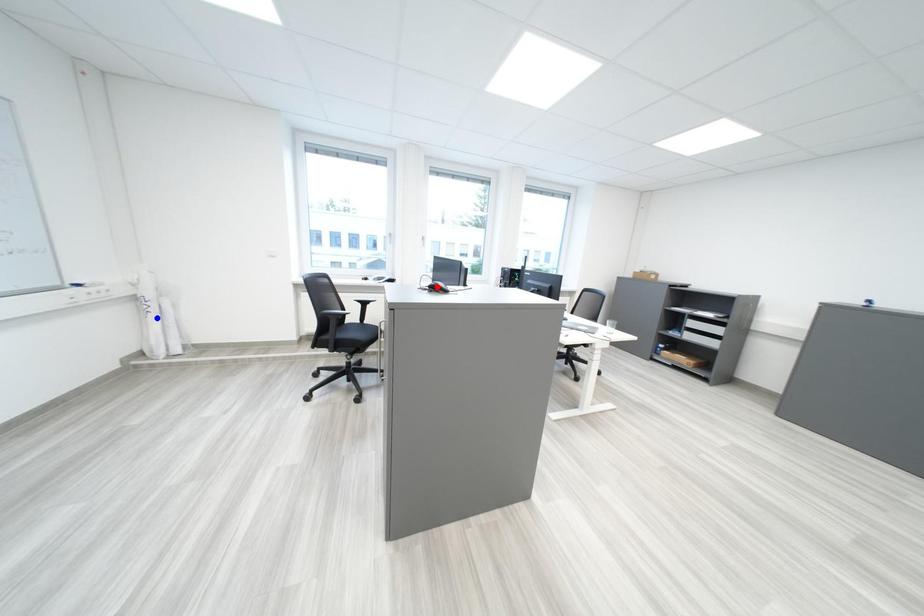
Question: In the image, two points are highlighted. Which point is nearer to the camera? Reply with the corresponding letter.

Choices:
 (A) blue point
 (B) red point

Answer: (B)